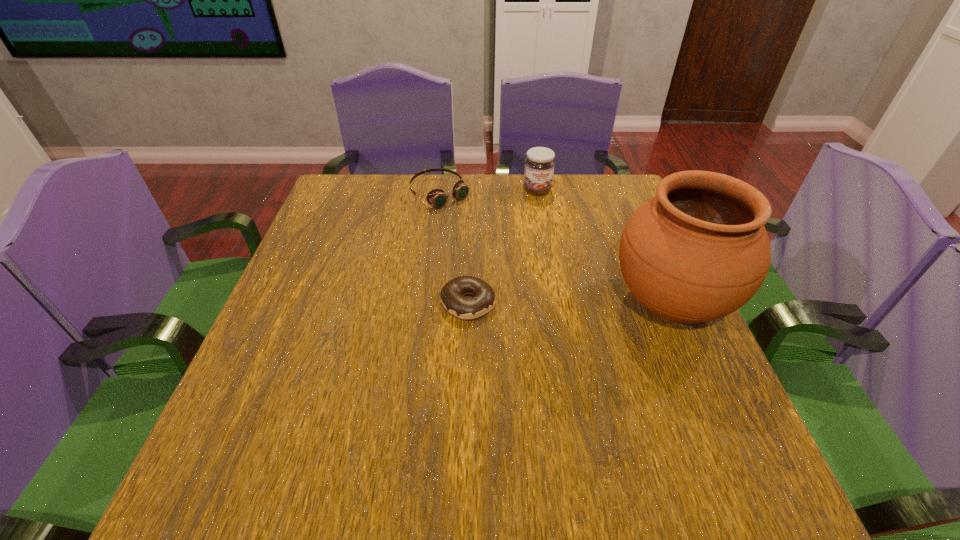
The width and height of the screenshot is (960, 540). In order to click on free space between the shortest object and the rightmost object in this screenshot , I will do `click(569, 303)`.

Identify the location of object that ranks as the closest to the doughnut. (697, 251).

Select which object appears as the second closest to the jam. Please provide its 2D coordinates. Your answer should be formatted as a tuple, i.e. [(x, y)], where the tuple contains the x and y coordinates of a point satisfying the conditions above.

[(697, 251)]

Identify the location of vacant space that satisfies the following two spatial constraints: 1. on the back side of the goggles; 2. on the left side of the second object from right to left. Image resolution: width=960 pixels, height=540 pixels. (441, 190).

In order to click on vacant point that satisfies the following two spatial constraints: 1. on the back side of the second shortest object; 2. on the right side of the jam in this screenshot , I will do `click(441, 190)`.

Image resolution: width=960 pixels, height=540 pixels. Find the location of `vacant space that satisfies the following two spatial constraints: 1. on the front side of the rightmost object; 2. on the left side of the third tallest object`. vacant space that satisfies the following two spatial constraints: 1. on the front side of the rightmost object; 2. on the left side of the third tallest object is located at coordinates (426, 303).

This screenshot has width=960, height=540. What are the coordinates of `free space that satisfies the following two spatial constraints: 1. on the back side of the third shortest object; 2. on the left side of the doughnut` in the screenshot? It's located at (471, 190).

Image resolution: width=960 pixels, height=540 pixels. I want to click on vacant point that satisfies the following two spatial constraints: 1. on the back side of the jam; 2. on the left side of the doughnut, so click(x=471, y=190).